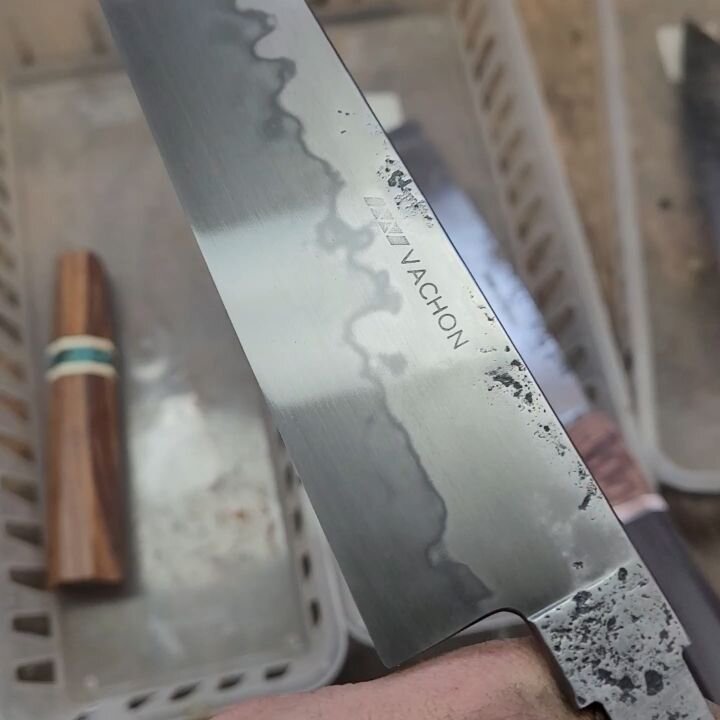
Locate an element on the screen. The height and width of the screenshot is (720, 720). table is located at coordinates (584, 191).